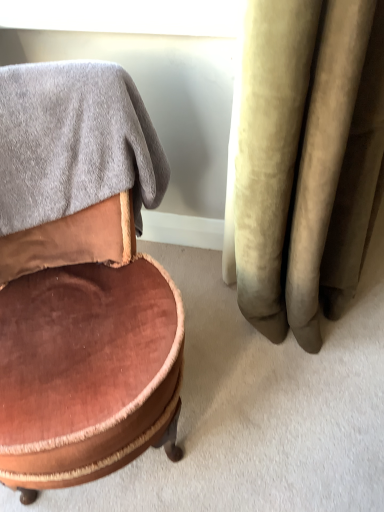
At what (x,y) coordinates should I click in order to perform the action: click on white glossy window screen at upper center. Please return your answer as a coordinate pair (x, y). Looking at the image, I should click on (126, 16).

Image resolution: width=384 pixels, height=512 pixels. Identify the location of gray soft towel at upper left. (74, 143).

Image resolution: width=384 pixels, height=512 pixels. Find the location of `white glossy window screen at upper center`. white glossy window screen at upper center is located at coordinates tap(126, 16).

From the image's perspective, is white glossy window screen at upper center positioned above or below gray soft towel at upper left?

Based on their image positions, white glossy window screen at upper center is located above gray soft towel at upper left.

Is gray soft towel at upper left inside white glossy window screen at upper center?

No, gray soft towel at upper left is located outside of white glossy window screen at upper center.

Based on their sizes in the image, would you say white glossy window screen at upper center is bigger or smaller than gray soft towel at upper left?

Clearly, white glossy window screen at upper center is smaller in size than gray soft towel at upper left.

Could you tell me if white glossy window screen at upper center is facing gray soft towel at upper left?

Yes, white glossy window screen at upper center is oriented towards gray soft towel at upper left.

Does velvet brown ottoman at left lie behind gray soft towel at upper left?

That is False.

Considering the positions of point (150, 386) and point (54, 137), is point (150, 386) closer or farther from the camera than point (54, 137)?

Point (150, 386) appears to be closer to the viewer than point (54, 137).

Looking at this image, is velvet brown ottoman at left not inside gray soft towel at upper left?

Yes.

Is velvet brown ottoman at left oriented away from gray soft towel at upper left?

Correct, velvet brown ottoman at left is looking away from gray soft towel at upper left.

Could you tell me if velvet brown ottoman at left is facing white glossy window screen at upper center?

No.

This screenshot has height=512, width=384. Find the location of `window screen behind the velvet brown ottoman at left`. window screen behind the velvet brown ottoman at left is located at coordinates (126, 16).

Between velvet brown ottoman at left and white glossy window screen at upper center, which one has larger size?

velvet brown ottoman at left is bigger.

Consider the image. Is velvet brown ottoman at left at the right side of white glossy window screen at upper center?

Incorrect, velvet brown ottoman at left is not on the right side of white glossy window screen at upper center.

Consider the image. From the image's perspective, is gray soft towel at upper left under velvet brown ottoman at left?

Incorrect, from the image's perspective, gray soft towel at upper left is higher than velvet brown ottoman at left.

Which point is more forward, (111, 130) or (1, 72)?

Positioned in front is point (111, 130).

Find the location of a particular element. Image resolution: width=384 pixels, height=512 pixels. bath towel that is on the right side of velvet brown ottoman at left is located at coordinates (74, 143).

Considering the sizes of objects gray soft towel at upper left and velvet brown ottoman at left in the image provided, who is thinner, gray soft towel at upper left or velvet brown ottoman at left?

gray soft towel at upper left.

Based on the photo, how different are the orientations of white glossy window screen at upper center and velvet brown ottoman at left in degrees?

white glossy window screen at upper center and velvet brown ottoman at left are facing 31.1 degrees away from each other.

Does white glossy window screen at upper center lie in front of velvet brown ottoman at left?

No.

Is white glossy window screen at upper center facing towards velvet brown ottoman at left?

Yes.

Would you say white glossy window screen at upper center contains velvet brown ottoman at left?

No, velvet brown ottoman at left is not inside white glossy window screen at upper center.

From a real-world perspective, who is located higher, gray soft towel at upper left or white glossy window screen at upper center?

white glossy window screen at upper center is physically above.

Who is taller, gray soft towel at upper left or white glossy window screen at upper center?

gray soft towel at upper left.

From the image's perspective, is gray soft towel at upper left located above white glossy window screen at upper center?

Incorrect, from the image's perspective, gray soft towel at upper left is lower than white glossy window screen at upper center.

The image size is (384, 512). Find the location of `window screen that appears behind the gray soft towel at upper left`. window screen that appears behind the gray soft towel at upper left is located at coordinates (126, 16).

Locate an element on the screen. The image size is (384, 512). chair below the gray soft towel at upper left (from the image's perspective) is located at coordinates (81, 281).

In the scene shown: From the image, which object appears to be nearer to velvet brown ottoman at left, white glossy window screen at upper center or gray soft towel at upper left?

gray soft towel at upper left is closer to velvet brown ottoman at left.

Considering their positions, is velvet brown ottoman at left positioned closer to gray soft towel at upper left than white glossy window screen at upper center?

velvet brown ottoman at left is positioned closer to the anchor gray soft towel at upper left.

Which object lies further to the anchor point white glossy window screen at upper center, gray soft towel at upper left or velvet brown ottoman at left?

velvet brown ottoman at left lies further to white glossy window screen at upper center than the other object.

Considering their positions, is velvet brown ottoman at left positioned closer to white glossy window screen at upper center than gray soft towel at upper left?

Based on the image, gray soft towel at upper left appears to be nearer to white glossy window screen at upper center.

Considering their positions, is white glossy window screen at upper center positioned closer to gray soft towel at upper left than velvet brown ottoman at left?

Based on the image, velvet brown ottoman at left appears to be nearer to gray soft towel at upper left.

When comparing their distances from velvet brown ottoman at left, does gray soft towel at upper left or white glossy window screen at upper center seem further?

white glossy window screen at upper center.

You are a GUI agent. You are given a task and a screenshot of the screen. Output one action in this format:
    pyautogui.click(x=<x>, y=<y>)
    Task: Click on the bath towel that lies between white glossy window screen at upper center and velvet brown ottoman at left from top to bottom
    This screenshot has height=512, width=384.
    Given the screenshot: What is the action you would take?
    pyautogui.click(x=74, y=143)